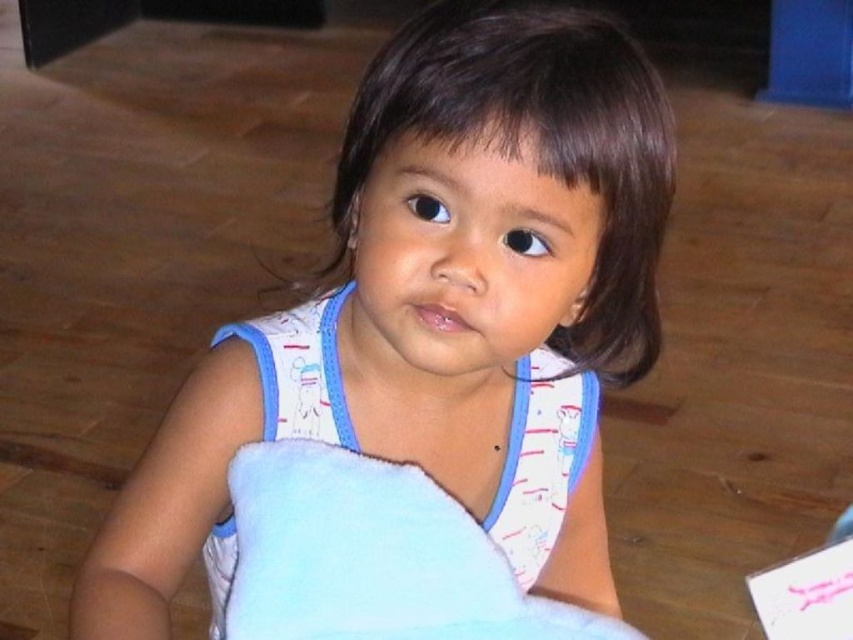
Does point (419, 268) come in front of point (569, 614)?

Yes, it is in front of point (569, 614).

Locate an element on the screen. Image resolution: width=853 pixels, height=640 pixels. white soft blanket at center is located at coordinates (439, 308).